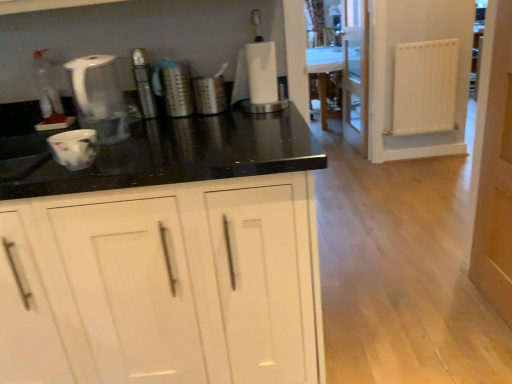
What do you see at coordinates (258, 79) in the screenshot? I see `white paper towel holder at center, positioned as the 4th appliance in left-to-right order` at bounding box center [258, 79].

How much space does white paper towel holder at center, positioned as the 4th appliance in left-to-right order, occupy vertically?

white paper towel holder at center, positioned as the 4th appliance in left-to-right order, is 9.54 inches in height.

What do you see at coordinates (144, 83) in the screenshot? I see `metallic cylindrical at center, which is counted as the 4th appliance, starting from the right` at bounding box center [144, 83].

In order to click on metallic cylindrical at center, which is counted as the 4th appliance, starting from the right in this screenshot , I will do `click(144, 83)`.

Image resolution: width=512 pixels, height=384 pixels. What do you see at coordinates (176, 88) in the screenshot? I see `brushed metal canisters at center, acting as the 3th appliance starting from the right` at bounding box center [176, 88].

Identify the location of transparent glass screen door at center. Image resolution: width=512 pixels, height=384 pixels. (356, 73).

Considering the relative sizes of white matte radiator at right and brushed metal canister at center, marked as the 3th appliance in a left-to-right arrangement, in the image provided, is white matte radiator at right smaller than brushed metal canister at center, marked as the 3th appliance in a left-to-right arrangement,?

Actually, white matte radiator at right might be larger than brushed metal canister at center, marked as the 3th appliance in a left-to-right arrangement.

Considering the sizes of white matte radiator at right and brushed metal canister at center, marked as the 3th appliance in a left-to-right arrangement, in the image, is white matte radiator at right wider or thinner than brushed metal canister at center, marked as the 3th appliance in a left-to-right arrangement,?

Clearly, white matte radiator at right has less width compared to brushed metal canister at center, marked as the 3th appliance in a left-to-right arrangement.

From the image's perspective, which object appears higher, white matte radiator at right or brushed metal canister at center, acting as the 2th appliance starting from the right?

white matte radiator at right is shown above in the image.

From the image's perspective, starting from the white matte radiator at right, which appliance is the 4th one below? Please provide its 2D coordinates.

[(209, 95)]

Based on the photo, would you consider white matte cabinet at center to be distant from white matte radiator at right?

Yes, white matte cabinet at center and white matte radiator at right are located far from each other.

From a real-world perspective, between white matte cabinet at center and white matte radiator at right, who is vertically higher?

From a 3D spatial view, white matte radiator at right is above.

Based on their sizes in the image, would you say white matte cabinet at center is bigger or smaller than white matte radiator at right?

Clearly, white matte cabinet at center is larger in size than white matte radiator at right.

Which of these two, white matte cabinet at center or white matte radiator at right, stands shorter?

white matte radiator at right.

Which of these two, white glossy paper towel holder at center or brushed metal canisters at center, which ranks as the second appliance in left-to-right order, is thinner?

With smaller width is brushed metal canisters at center, which ranks as the second appliance in left-to-right order.

In the image, is white glossy paper towel holder at center positioned in front of or behind brushed metal canisters at center, acting as the 3th appliance starting from the right?

Visually, white glossy paper towel holder at center is located behind brushed metal canisters at center, acting as the 3th appliance starting from the right.

From a real-world perspective, between white glossy paper towel holder at center and brushed metal canisters at center, which ranks as the second appliance in left-to-right order, who is vertically higher?

brushed metal canisters at center, which ranks as the second appliance in left-to-right order, from a real-world perspective.

From a real-world perspective, who is located lower, transparent glass screen door at center or white plastic kettle at upper left?

In real-world perspective, transparent glass screen door at center is lower.

Consider the image. In terms of height, does transparent glass screen door at center look taller or shorter compared to white plastic kettle at upper left?

In the image, transparent glass screen door at center appears to be taller than white plastic kettle at upper left.

You are a GUI agent. You are given a task and a screenshot of the screen. Output one action in this format:
    pyautogui.click(x=<x>, y=<y>)
    Task: Click on the home appliance above the transparent glass screen door at center (from a real-world perspective)
    
    Given the screenshot: What is the action you would take?
    pyautogui.click(x=99, y=97)

Is there a large distance between transparent glass screen door at center and white plastic kettle at upper left?

Yes.

Is the depth of white paper towel holder at center, which is the 1th appliance in right-to-left order, greater than that of brushed metal canisters at center, which ranks as the second appliance in left-to-right order?

No, white paper towel holder at center, which is the 1th appliance in right-to-left order, is closer to the viewer.

Is white paper towel holder at center, positioned as the 4th appliance in left-to-right order, oriented away from brushed metal canisters at center, acting as the 3th appliance starting from the right?

No, brushed metal canisters at center, acting as the 3th appliance starting from the right, is not at the back of white paper towel holder at center, positioned as the 4th appliance in left-to-right order.

From a real-world perspective, who is located higher, white paper towel holder at center, positioned as the 4th appliance in left-to-right order, or brushed metal canisters at center, which ranks as the second appliance in left-to-right order?

white paper towel holder at center, positioned as the 4th appliance in left-to-right order, from a real-world perspective.

In terms of height, does white paper towel holder at center, which is the 1th appliance in right-to-left order, look taller or shorter compared to brushed metal canisters at center, acting as the 3th appliance starting from the right?

white paper towel holder at center, which is the 1th appliance in right-to-left order, is taller than brushed metal canisters at center, acting as the 3th appliance starting from the right.

In the image, is transparent glass screen door at center positioned in front of or behind white matte radiator at right?

Clearly, transparent glass screen door at center is behind white matte radiator at right.

Considering the sizes of objects transparent glass screen door at center and white matte radiator at right in the image provided, who is bigger, transparent glass screen door at center or white matte radiator at right?

transparent glass screen door at center.

Who is shorter, transparent glass screen door at center or white matte radiator at right?

With less height is white matte radiator at right.

Would you say transparent glass screen door at center is outside white matte radiator at right?

Absolutely, transparent glass screen door at center is external to white matte radiator at right.

Is white plastic kettle at upper left placed right next to white matte cabinet at center?

No, white plastic kettle at upper left is not next to white matte cabinet at center.

Considering the sizes of white plastic kettle at upper left and white matte cabinet at center in the image, is white plastic kettle at upper left taller or shorter than white matte cabinet at center?

white plastic kettle at upper left is shorter than white matte cabinet at center.

Is white plastic kettle at upper left smaller than white matte cabinet at center?

Indeed, white plastic kettle at upper left has a smaller size compared to white matte cabinet at center.

Can you confirm if white plastic kettle at upper left is positioned to the right of white matte cabinet at center?

Yes.

I want to click on appliance that is the 1st object located in front of the white matte radiator at right, so click(209, 95).

This screenshot has width=512, height=384. I want to click on radiator lying behind the white matte cabinet at center, so click(x=425, y=87).

When comparing their distances from wooden door at right, does transparent glass screen door at center or white matte radiator at right seem closer?

white matte radiator at right is closer to wooden door at right.

When comparing their distances from brushed metal canisters at center, acting as the 3th appliance starting from the right, does brushed metal canister at center, acting as the 2th appliance starting from the right, or white glossy paper towel holder at center seem further?

white glossy paper towel holder at center is further to brushed metal canisters at center, acting as the 3th appliance starting from the right.

Considering their positions, is white matte radiator at right positioned closer to metallic cylindrical at center, which is counted as the 4th appliance, starting from the right, than brushed metal canisters at center, acting as the 3th appliance starting from the right?

The object closer to metallic cylindrical at center, which is counted as the 4th appliance, starting from the right, is brushed metal canisters at center, acting as the 3th appliance starting from the right.

From the picture: Looking at the image, which one is located further to white paper towel holder at center, which is the 1th appliance in right-to-left order, wooden door at right or white glossy paper towel holder at center?

white glossy paper towel holder at center lies further to white paper towel holder at center, which is the 1th appliance in right-to-left order, than the other object.

Looking at the image, which one is located closer to brushed metal canister at center, acting as the 2th appliance starting from the right, white glossy paper towel holder at center or white paper towel holder at center, positioned as the 4th appliance in left-to-right order?

white paper towel holder at center, positioned as the 4th appliance in left-to-right order, is positioned closer to the anchor brushed metal canister at center, acting as the 2th appliance starting from the right.

Based on their spatial positions, is brushed metal canisters at center, acting as the 3th appliance starting from the right, or transparent glass screen door at center closer to white matte cabinet at center?

brushed metal canisters at center, acting as the 3th appliance starting from the right, lies closer to white matte cabinet at center than the other object.

Considering their positions, is white plastic kettle at upper left positioned further to white glossy paper towel holder at center than metallic cylindrical at center, which ranks as the first appliance in left-to-right order?

The object further to white glossy paper towel holder at center is white plastic kettle at upper left.

Which object lies further to the anchor point metallic cylindrical at center, which ranks as the first appliance in left-to-right order, white matte radiator at right or brushed metal canister at center, acting as the 2th appliance starting from the right?

Answer: white matte radiator at right is further to metallic cylindrical at center, which ranks as the first appliance in left-to-right order.

This screenshot has height=384, width=512. I want to click on screen door between white paper towel holder at center, which is the 1th appliance in right-to-left order, and white glossy paper towel holder at center in the front-back direction, so click(x=356, y=73).

You are a GUI agent. You are given a task and a screenshot of the screen. Output one action in this format:
    pyautogui.click(x=<x>, y=<y>)
    Task: Click on the home appliance between white matte cabinet at center and wooden door at right from left to right
    This screenshot has width=512, height=384.
    Given the screenshot: What is the action you would take?
    click(99, 97)

Where is `door located between white matte cabinet at center and white matte radiator at right in the depth direction`? door located between white matte cabinet at center and white matte radiator at right in the depth direction is located at coordinates (495, 175).

Locate an element on the screen. This screenshot has width=512, height=384. radiator positioned between brushed metal canister at center, acting as the 2th appliance starting from the right, and white glossy paper towel holder at center from near to far is located at coordinates (425, 87).